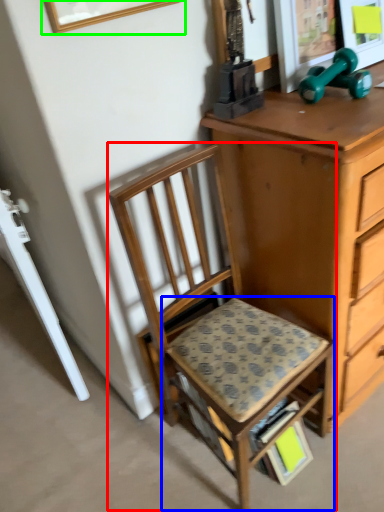
Question: Estimate the real-world distances between objects in this image. Which object is farther from chair (highlighted by a red box), step stool (highlighted by a blue box) or picture frame (highlighted by a green box)?

Choices:
 (A) step stool
 (B) picture frame

Answer: (B)